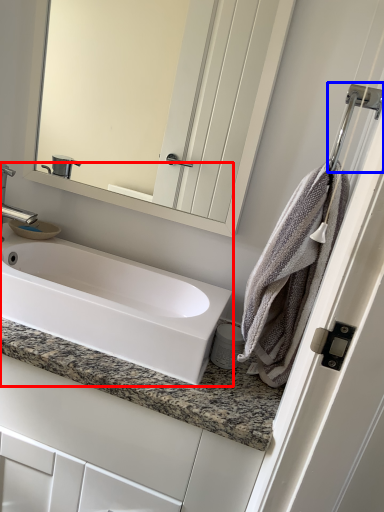
Question: Which object appears closest to the camera in this image, sink (highlighted by a red box) or shower (highlighted by a blue box)?

Choices:
 (A) sink
 (B) shower

Answer: (B)